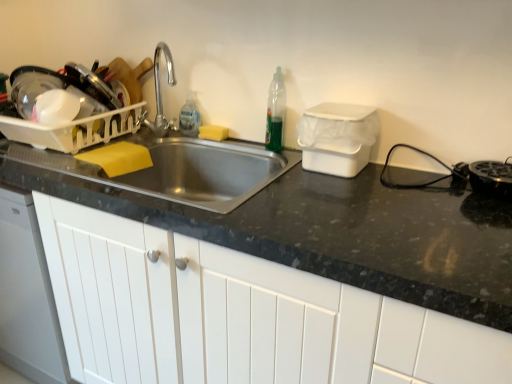
Question: Which direction should I rotate to look at translucent plastic bottle at sink, which is counted as the first bottle, starting from the back?

Choices:
 (A) right
 (B) left

Answer: (B)

Question: Considering the relative sizes of black plastic toaster at right, the 1th appliance from the right, and white matte cabinet at center in the image provided, is black plastic toaster at right, the 1th appliance from the right, thinner than white matte cabinet at center?

Choices:
 (A) yes
 (B) no

Answer: (A)

Question: From a real-world perspective, is black plastic toaster at right, the 1th appliance from the right, over white matte cabinet at center?

Choices:
 (A) no
 (B) yes

Answer: (B)

Question: Does black plastic toaster at right, the 3th appliance positioned from the left, appear on the left side of white matte cabinet at center?

Choices:
 (A) yes
 (B) no

Answer: (B)

Question: Considering the relative sizes of black plastic toaster at right, the 1th appliance from the right, and white matte cabinet at center in the image provided, is black plastic toaster at right, the 1th appliance from the right, wider than white matte cabinet at center?

Choices:
 (A) no
 (B) yes

Answer: (A)

Question: Is black plastic toaster at right, the 3th appliance positioned from the left, closer to the viewer compared to white matte cabinet at center?

Choices:
 (A) no
 (B) yes

Answer: (A)

Question: From a real-world perspective, is black plastic toaster at right, the 1th appliance from the right, under white matte cabinet at center?

Choices:
 (A) no
 (B) yes

Answer: (A)

Question: Is black plastic toaster at right, the 1th appliance from the right, facing towards white plastic dish rack at left, which ranks as the first appliance in left-to-right order?

Choices:
 (A) no
 (B) yes

Answer: (A)

Question: Can you confirm if black plastic toaster at right, the 3th appliance positioned from the left, is wider than white plastic dish rack at left, placed as the 3th appliance when sorted from right to left?

Choices:
 (A) no
 (B) yes

Answer: (A)

Question: Is black plastic toaster at right, the 1th appliance from the right, at the right side of white plastic dish rack at left, which ranks as the first appliance in left-to-right order?

Choices:
 (A) no
 (B) yes

Answer: (B)

Question: Is black plastic toaster at right, the 3th appliance positioned from the left, outside of white plastic dish rack at left, placed as the 3th appliance when sorted from right to left?

Choices:
 (A) no
 (B) yes

Answer: (B)

Question: Is black plastic toaster at right, the 3th appliance positioned from the left, further to camera compared to white plastic dish rack at left, placed as the 3th appliance when sorted from right to left?

Choices:
 (A) yes
 (B) no

Answer: (B)

Question: Is black plastic toaster at right, the 3th appliance positioned from the left, looking in the opposite direction of white plastic dish rack at left, which ranks as the first appliance in left-to-right order?

Choices:
 (A) no
 (B) yes

Answer: (A)

Question: Is white plastic dish rack at left, placed as the 3th appliance when sorted from right to left, looking in the opposite direction of black plastic toaster at right, the 3th appliance positioned from the left?

Choices:
 (A) yes
 (B) no

Answer: (B)